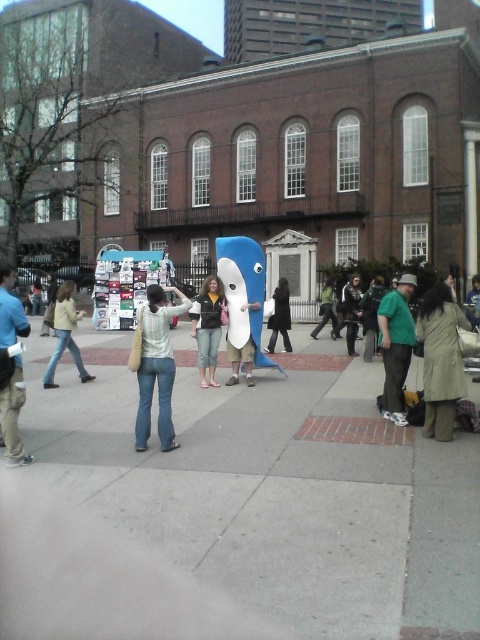
Question: Which is nearer to the dark green shirt at center?

Choices:
 (A) blue jeans at left
 (B) light yellow jacket at left
 (C) denim jeans at center

Answer: (B)

Question: Considering the real-world distances, which object is closest to the denim jacket at center?

Choices:
 (A) denim jeans at center
 (B) green matte shirt at center

Answer: (A)

Question: Is green matte shirt at center behind white matte shark at center?

Choices:
 (A) no
 (B) yes

Answer: (A)

Question: Is light yellow jacket at left to the left of black fabric coat at center from the viewer's perspective?

Choices:
 (A) yes
 (B) no

Answer: (A)

Question: Does green matte shirt at center have a smaller size compared to green cotton shirt at center?

Choices:
 (A) yes
 (B) no

Answer: (A)

Question: Among these points, which one is nearest to the camera?

Choices:
 (A) (430, 433)
 (B) (242, 310)
 (C) (3, 440)
 (D) (199, 364)

Answer: (C)